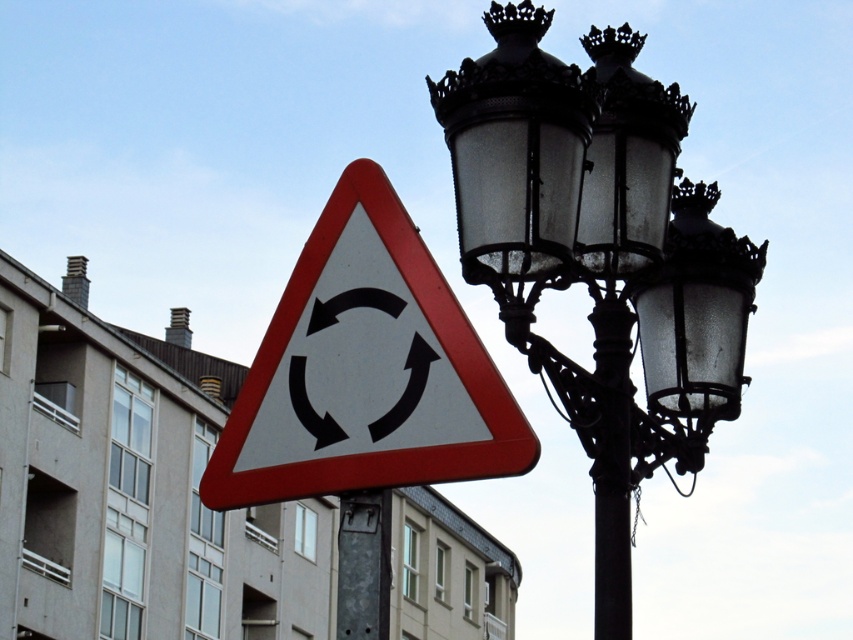
You are a delivery driver who needs to park your truck near the metallic gray pole at center without blocking the black wrought iron streetlight at upper right. The truck requires a parking space of at least 6 meters in length. Can you safely park your truck there?

The distance between the black wrought iron streetlight at upper right and the metallic gray pole at center is 5.16 meters, which is less than the required 6 meters. Therefore, parking the truck there would not provide enough space and might block the streetlight.

Based on the photo, you are a pedestrian standing at the edge of the road looking towards the white plastic triangle at center and the metallic gray pole at center. Which object is located higher up in the image?

The white plastic triangle at center is positioned over the metallic gray pole at center, so it is higher up in the image.